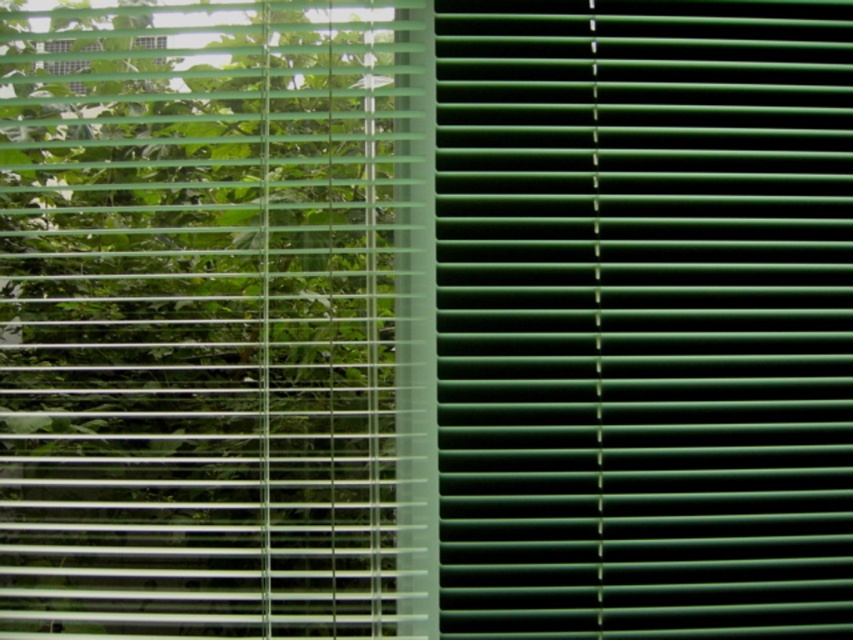
You are standing in a room with window blinds. You notice the green plastic blinds at right. Based on their position, can you determine if they are blocking more light on the left or the right side of the window?

The green plastic blinds at right are located at point coordinates that suggest they are positioned on the right side of the window. Since the right side has mostly closed slats, they are blocking more light on the right side of the window.

You are looking through a window with two types of blinds. You see the green plastic blinds at right and the green matte blinds at left. Which set of blinds is closer to the window frame on the right side?

The green plastic blinds at right is to the right of green matte blinds at left, so the green plastic blinds at right is closer to the window frame on the right side.